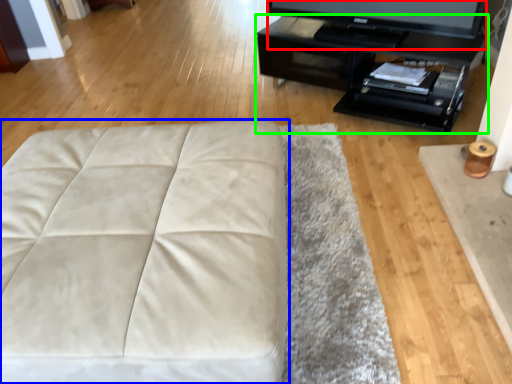
Question: Estimate the real-world distances between objects in this image. Which object is farther from television (highlighted by a red box), furniture (highlighted by a blue box) or table (highlighted by a green box)?

Choices:
 (A) furniture
 (B) table

Answer: (A)